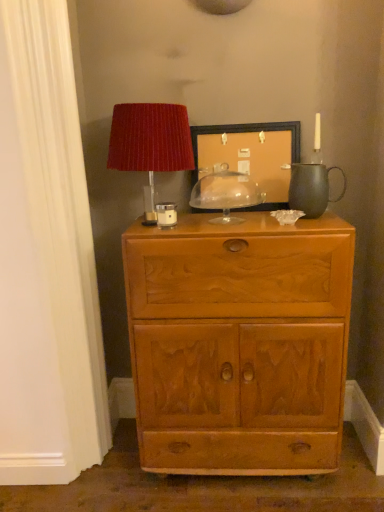
You are a GUI agent. You are given a task and a screenshot of the screen. Output one action in this format:
    pyautogui.click(x=<x>, y=<y>)
    Task: Click on the vacant area in front of wooden picture frame at center
    This screenshot has height=512, width=384.
    Given the screenshot: What is the action you would take?
    pyautogui.click(x=264, y=226)